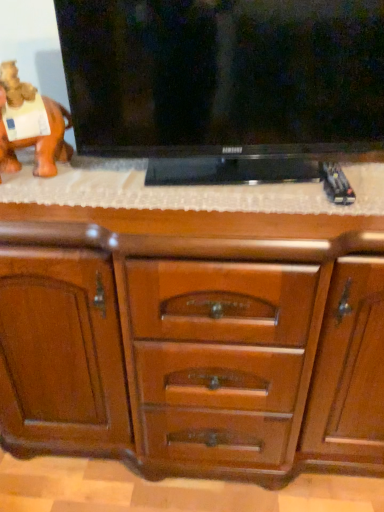
Question: Can you confirm if black glossy flat-screen tv at upper center is thinner than wooden chest of drawers at center?

Choices:
 (A) yes
 (B) no

Answer: (A)

Question: From a real-world perspective, is black glossy flat-screen tv at upper center under wooden chest of drawers at center?

Choices:
 (A) no
 (B) yes

Answer: (A)

Question: Is black glossy flat-screen tv at upper center far away from wooden chest of drawers at center?

Choices:
 (A) no
 (B) yes

Answer: (A)

Question: Considering the relative sizes of black glossy flat-screen tv at upper center and wooden chest of drawers at center in the image provided, is black glossy flat-screen tv at upper center taller than wooden chest of drawers at center?

Choices:
 (A) yes
 (B) no

Answer: (B)

Question: From the image's perspective, is black glossy flat-screen tv at upper center under wooden chest of drawers at center?

Choices:
 (A) no
 (B) yes

Answer: (A)

Question: Which is correct: black glossy flat-screen tv at upper center is inside wooden chest of drawers at center, or outside of it?

Choices:
 (A) outside
 (B) inside

Answer: (A)

Question: Looking at the image, does black glossy flat-screen tv at upper center seem bigger or smaller compared to wooden chest of drawers at center?

Choices:
 (A) small
 (B) big

Answer: (A)

Question: Considering the positions of point (248, 75) and point (238, 273), is point (248, 75) closer or farther from the camera than point (238, 273)?

Choices:
 (A) closer
 (B) farther

Answer: (B)

Question: From the image's perspective, relative to wooden chest of drawers at center, is black glossy flat-screen tv at upper center above or below?

Choices:
 (A) below
 (B) above

Answer: (B)

Question: Is orange matte elephant at left in front of or behind wooden chest of drawers at center in the image?

Choices:
 (A) behind
 (B) front

Answer: (A)

Question: Does point (3, 117) appear closer or farther from the camera than point (107, 351)?

Choices:
 (A) farther
 (B) closer

Answer: (B)

Question: Is orange matte elephant at left spatially inside wooden chest of drawers at center, or outside of it?

Choices:
 (A) outside
 (B) inside

Answer: (A)

Question: Considering the positions of orange matte elephant at left and wooden chest of drawers at center in the image, is orange matte elephant at left wider or thinner than wooden chest of drawers at center?

Choices:
 (A) thin
 (B) wide

Answer: (A)

Question: In the image, is wooden chest of drawers at center on the left side or the right side of orange matte elephant at left?

Choices:
 (A) left
 (B) right

Answer: (B)

Question: Based on their sizes in the image, would you say wooden chest of drawers at center is bigger or smaller than orange matte elephant at left?

Choices:
 (A) small
 (B) big

Answer: (B)